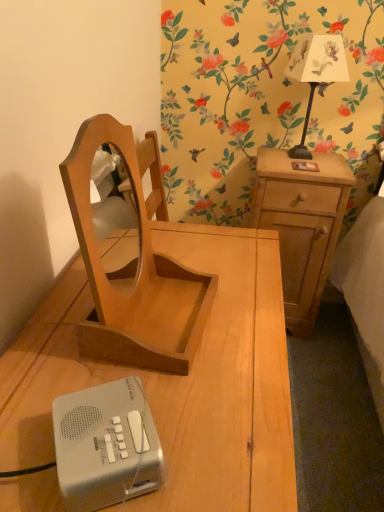
At what (x,y) coordinates should I click in order to perform the action: click on vacant space to the right of light brown wood mirror at center. Please return your answer as a coordinate pair (x, y). The height and width of the screenshot is (512, 384). Looking at the image, I should click on (244, 325).